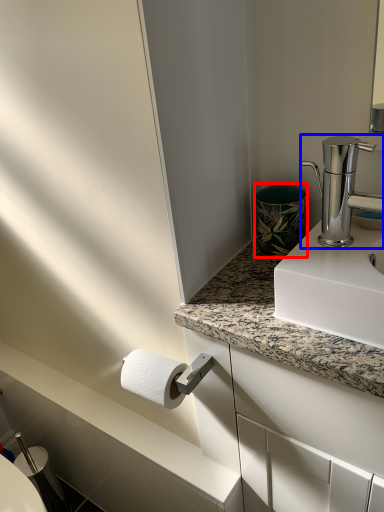
Question: Which object is closer to the camera taking this photo, appliance (highlighted by a red box) or tap (highlighted by a blue box)?

Choices:
 (A) appliance
 (B) tap

Answer: (B)